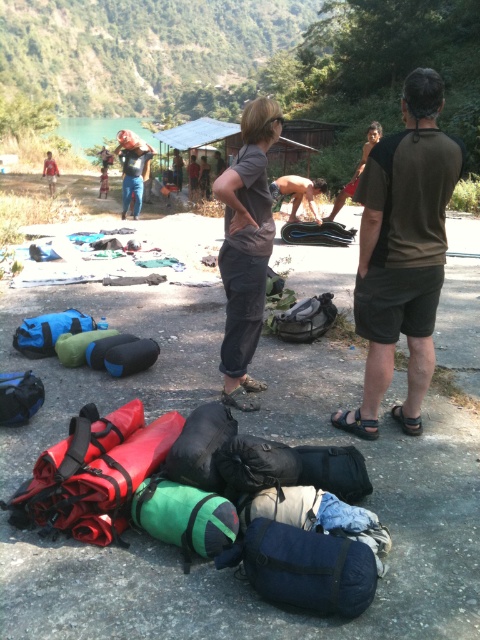
Question: Which object appears farthest from the camera in this image?

Choices:
 (A) smooth skin woman at center
 (B) matte blue jeans at center
 (C) brown/cotton t-shirt at right
 (D) matte black backpack at center

Answer: (B)

Question: Is matte black backpack at center wider than shiny black shirt at center?

Choices:
 (A) no
 (B) yes

Answer: (A)

Question: Which of these objects is positioned closest to the shiny black shirt at center?

Choices:
 (A) smooth skin woman at center
 (B) matte blue jeans at center
 (C) brown cotton shirt at center

Answer: (A)

Question: Is the position of brown cotton shirt at center less distant than that of smooth skin woman at center?

Choices:
 (A) no
 (B) yes

Answer: (B)

Question: Where is brown/cotton t-shirt at right located in relation to matte black backpack at center in the image?

Choices:
 (A) left
 (B) right

Answer: (B)

Question: Estimate the real-world distances between objects in this image. Which object is closer to the brown/cotton t-shirt at right?

Choices:
 (A) shiny black shirt at center
 (B) smooth skin woman at center
 (C) matte black backpack at center

Answer: (C)